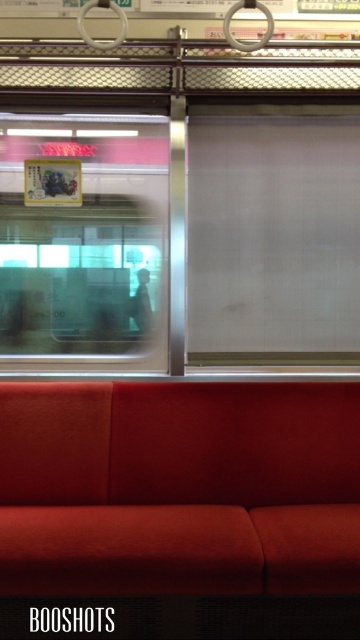
You are a passenger on the train and want to see the view outside through the transparent glass window at upper left. However, there is a smooth black jacket at center blocking your view. Can you estimate whether the window is wider than the jacket to see around it?

The transparent glass window at upper left might be wider than smooth black jacket at center, so there is a possibility that you can see around the jacket if the window is indeed wider.

You are a passenger on a train and want to look outside through the transparent glass window at upper left. However, there is a smooth black jacket at center in your way. Can you move the jacket to see outside?

The transparent glass window at upper left is in front of the smooth black jacket at center, meaning the window is closer to you than the jacket. Since the window is already in front, you don not need to move the jacket to see outside.

You are a passenger sitting in the train carriage. You want to look outside but there is a smooth black jacket at center blocking your view. Can you see through the transparent glass window at upper left to the outside?

→ The transparent glass window at upper left is located above the smooth black jacket at center, so you can see through the transparent glass window at upper left to the outside by looking above the smooth black jacket at center.